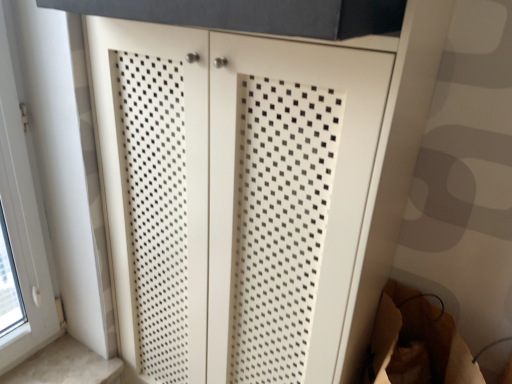
You are a GUI agent. You are given a task and a screenshot of the screen. Output one action in this format:
    pyautogui.click(x=<x>, y=<y>)
    Task: Click on the brown paper bag at lower right
    This screenshot has height=384, width=512.
    Given the screenshot: What is the action you would take?
    pyautogui.click(x=417, y=342)

The image size is (512, 384). Describe the element at coordinates (417, 342) in the screenshot. I see `brown paper bag at lower right` at that location.

The image size is (512, 384). I want to click on brown paper bag at lower right, so click(417, 342).